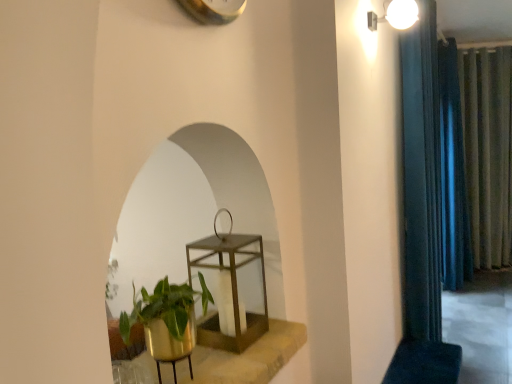
Question: Relative to gold metallic plant pot at lower left, is dark blue fabric curtain at right, the second curtain in the back-to-front sequence, in front or behind?

Choices:
 (A) behind
 (B) front

Answer: (A)

Question: Considering the positions of dark blue fabric curtain at right, which appears as the 2th curtain when viewed from the right, and gold metallic plant pot at lower left in the image, is dark blue fabric curtain at right, which appears as the 2th curtain when viewed from the right, bigger or smaller than gold metallic plant pot at lower left?

Choices:
 (A) big
 (B) small

Answer: (A)

Question: Considering the real-world distances, which object is closest to the blue velvet curtain at right, which appears as the third curtain when viewed from the back?

Choices:
 (A) dark blue fabric curtain at right, acting as the 2th curtain starting from the front
 (B) white glossy light fixture at upper right
 (C) metallic gold lantern at center
 (D) green textured curtain at right, which is counted as the 3th curtain, starting from the left
 (E) gold metallic plant pot at lower left

Answer: (B)

Question: Based on their relative distances, which object is farther from the metallic gold lantern at center?

Choices:
 (A) gold metallic plant pot at lower left
 (B) white glossy light fixture at upper right
 (C) blue velvet curtain at right, which appears as the third curtain when viewed from the back
 (D) green textured curtain at right, the third curtain positioned from the front
 (E) dark blue fabric curtain at right, acting as the 2th curtain starting from the front

Answer: (D)